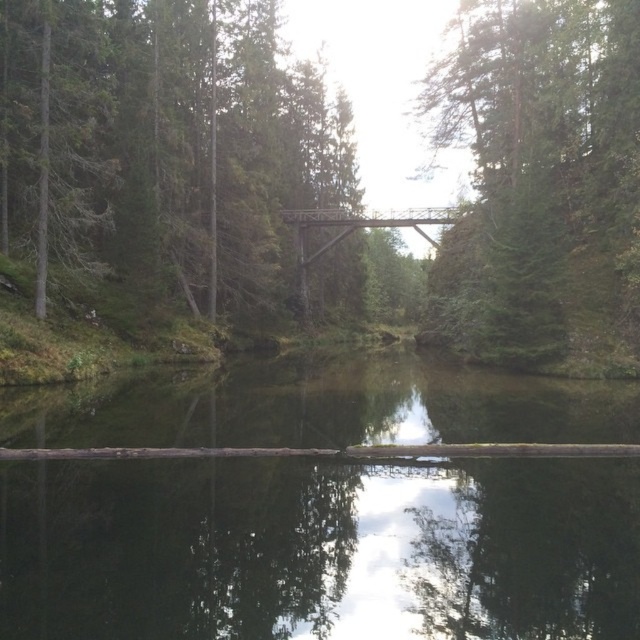
Which of these two, greenish-brown wood at center or green matte tree at upper center, stands shorter?

Standing shorter between the two is greenish-brown wood at center.

Is greenish-brown wood at center smaller than green matte tree at upper center?

Yes.

This screenshot has width=640, height=640. What are the coordinates of `greenish-brown wood at center` in the screenshot? It's located at (320, 548).

Does point (410, 632) lie behind point (305, 292)?

That is False.

Is greenish-brown wood at center thinner than rusty metal bridge at center?

No, greenish-brown wood at center is not thinner than rusty metal bridge at center.

The image size is (640, 640). What are the coordinates of `greenish-brown wood at center` in the screenshot? It's located at (320, 548).

Is point (186, 132) positioned behind point (472, 83)?

No.

Measure the distance from brown wood bridge at center to green matte tree at upper center.

The distance of brown wood bridge at center from green matte tree at upper center is 19.08 meters.

At what (x,y) coordinates should I click in order to perform the action: click on brown wood bridge at center. Please return your answer as a coordinate pair (x, y). This screenshot has width=640, height=640. Looking at the image, I should click on (164, 147).

Where is `brown wood bridge at center`? The width and height of the screenshot is (640, 640). brown wood bridge at center is located at coordinates (164, 147).